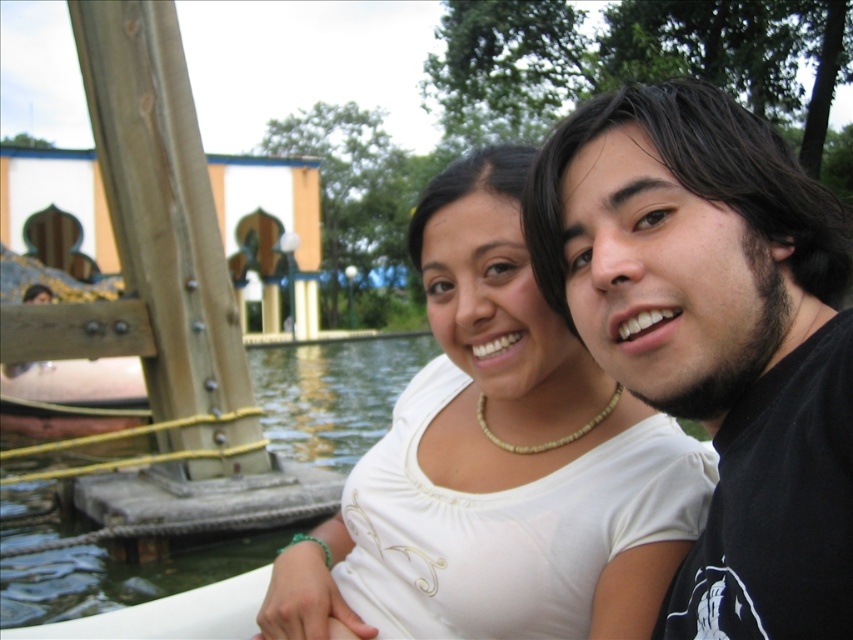
You are a photographer trying to capture the perfect shot of the scene. You notice a point at coordinates (x=717, y=336). What object is located at this point?

The point at coordinates (x=717, y=336) indicates the black matte shirt at upper right.